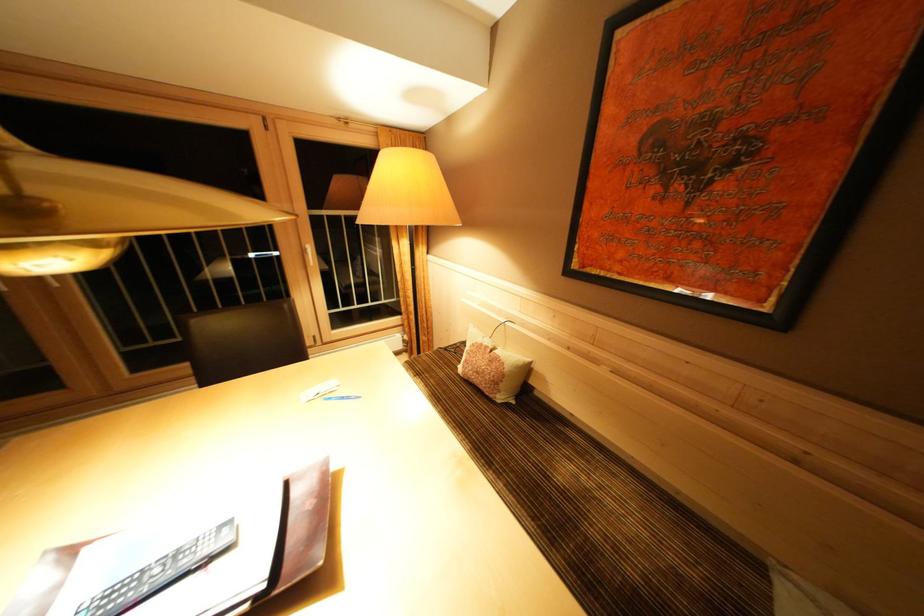
Locate an element on the screen. Image resolution: width=924 pixels, height=616 pixels. metal window handle is located at coordinates (310, 254).